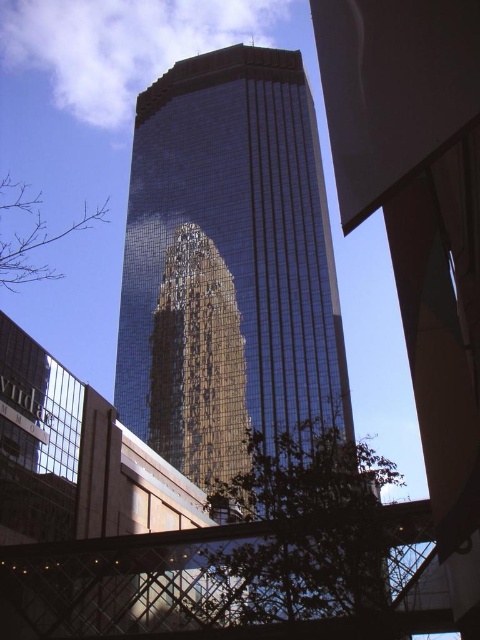
Which of these two, green leafy tree at lower center or bare branches at lower left, stands shorter?

Standing shorter between the two is green leafy tree at lower center.

Which is behind, point (338, 465) or point (38, 250)?

Point (38, 250)

Is point (266, 488) behind point (17, 218)?

No, it is not.

Where is `green leafy tree at lower center`? This screenshot has width=480, height=640. green leafy tree at lower center is located at coordinates (302, 532).

Which is more to the right, shiny glass tower at center or bare branches at lower left?

shiny glass tower at center

Measure the distance between point (x=201, y=401) and camera.

They are 87.33 meters apart.

You are a GUI agent. You are given a task and a screenshot of the screen. Output one action in this format:
    pyautogui.click(x=<x>, y=<y>)
    Task: Click on the shiny glass tower at center
    The image size is (480, 640).
    Given the screenshot: What is the action you would take?
    pyautogui.click(x=228, y=266)

Can you confirm if shiny glass tower at center is positioned to the right of green leafy tree at lower center?

Incorrect, shiny glass tower at center is not on the right side of green leafy tree at lower center.

Measure the distance between shiny glass tower at center and green leafy tree at lower center.

shiny glass tower at center and green leafy tree at lower center are 30.15 meters apart.

In order to click on shiny glass tower at center in this screenshot , I will do `click(228, 266)`.